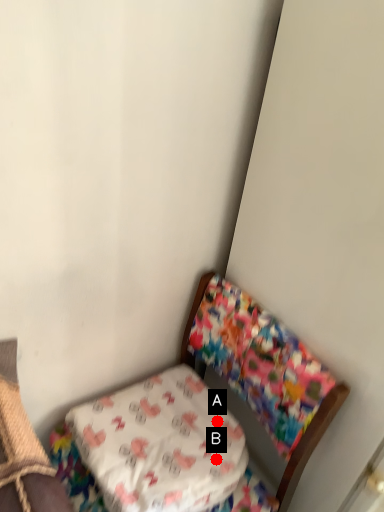
Question: Two points are circled on the image, labeled by A and B beside each circle. Which point is closer to the camera?

Choices:
 (A) A is closer
 (B) B is closer

Answer: (B)